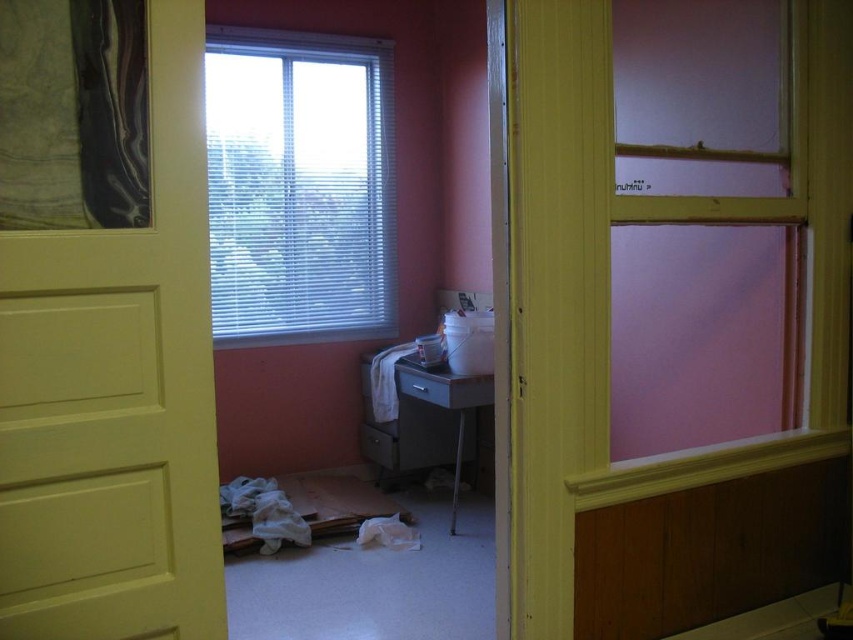
Is point (141, 636) closer to viewer compared to point (103, 12)?

No.

Which is behind, point (3, 337) or point (109, 83)?

Point (109, 83)

Where is `yellow matte door at center`? yellow matte door at center is located at coordinates (115, 396).

Is white blinds at upper center smaller than black marble painting at upper left?

Incorrect, white blinds at upper center is not smaller in size than black marble painting at upper left.

Which is in front, point (325, 218) or point (51, 40)?

Point (51, 40) is in front.

I want to click on white blinds at upper center, so click(x=299, y=186).

The width and height of the screenshot is (853, 640). Describe the element at coordinates (115, 396) in the screenshot. I see `yellow matte door at center` at that location.

Who is taller, yellow matte door at center or white blinds at upper center?

Standing taller between the two is white blinds at upper center.

What do you see at coordinates (115, 396) in the screenshot?
I see `yellow matte door at center` at bounding box center [115, 396].

Find the location of `yellow matte door at center`. yellow matte door at center is located at coordinates (115, 396).